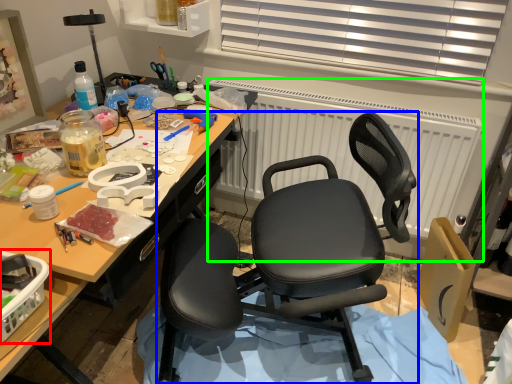
Question: Which is farther away from box (highlighted by a red box)? chair (highlighted by a blue box) or radiator (highlighted by a green box)?

Choices:
 (A) chair
 (B) radiator

Answer: (B)